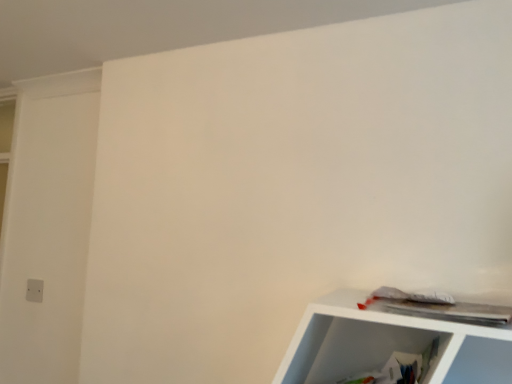
This screenshot has height=384, width=512. I want to click on white plastic cabinet at lower right, so click(362, 347).

Image resolution: width=512 pixels, height=384 pixels. What do you see at coordinates (362, 347) in the screenshot? I see `white plastic cabinet at lower right` at bounding box center [362, 347].

Find the location of a particular element. The image size is (512, 384). white plastic cabinet at lower right is located at coordinates (362, 347).